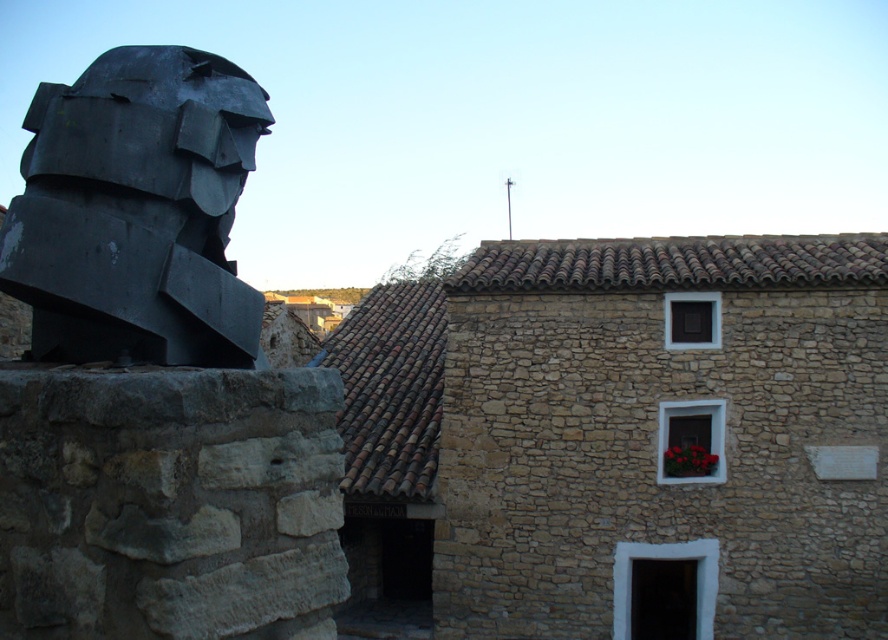
Question: Is matte black sculpture at left closer to the viewer compared to red matte flower box at center?

Choices:
 (A) no
 (B) yes

Answer: (B)

Question: Which point is farther from the camera taking this photo?

Choices:
 (A) (226, 176)
 (B) (678, 456)

Answer: (B)

Question: Which object is farther from the camera taking this photo?

Choices:
 (A) matte black sculpture at left
 (B) red matte flower box at center

Answer: (B)

Question: Can you confirm if matte black sculpture at left is smaller than red matte flower box at center?

Choices:
 (A) no
 (B) yes

Answer: (A)

Question: In this image, where is matte black sculpture at left located relative to red matte flower box at center?

Choices:
 (A) below
 (B) above

Answer: (B)